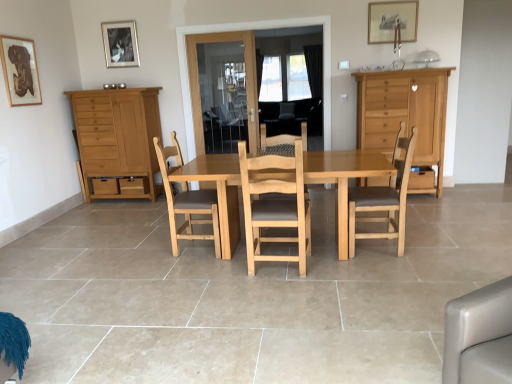
Question: From the image's perspective, is light brown wood chair at center, which is the first chair in left-to-right order, above or below wooden picture frame at upper center, which appears as the second picture frame when viewed from the front?

Choices:
 (A) above
 (B) below

Answer: (B)

Question: Considering the positions of light brown wood chair at center, which is the first chair in left-to-right order, and wooden picture frame at upper center, which is the 3th picture frame in left-to-right order, in the image, is light brown wood chair at center, which is the first chair in left-to-right order, taller or shorter than wooden picture frame at upper center, which is the 3th picture frame in left-to-right order,?

Choices:
 (A) short
 (B) tall

Answer: (B)

Question: Estimate the real-world distances between objects in this image. Which object is closer to the light brown wood chair at center, which ranks as the 2th chair in left-to-right order?

Choices:
 (A) light brown wooden table at center
 (B) wooden picture frame at upper center, which ranks as the first picture frame in right-to-left order
 (C) light brown wood cabinet at left, which is counted as the 1th cabinetry, starting from the left
 (D) wooden drawer at right
 (E) transparent glass door at center, the 1th glass door in the right-to-left sequence

Answer: (A)

Question: Based on their relative distances, which object is nearer to the light brown wood chair at center, acting as the second chair starting from the right?

Choices:
 (A) wooden framed map at upper left, positioned as the 3th picture frame in back-to-front order
 (B) wooden drawer at right
 (C) light brown wood cabinet at left, which is counted as the 1th cabinetry, starting from the left
 (D) light brown wooden table at center
 (E) metallic silver picture frame at upper center, positioned as the third picture frame in front-to-back order

Answer: (D)